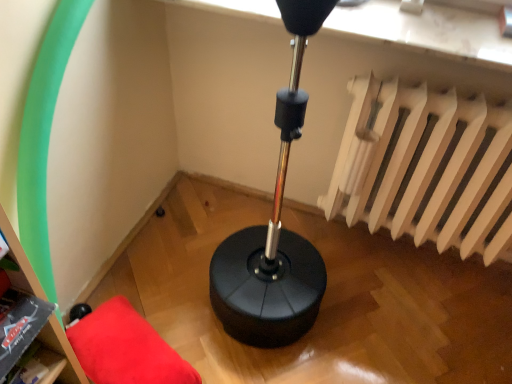
Question: From a real-world perspective, is matte black bookshelf at lower left over white matte radiator at upper right?

Choices:
 (A) yes
 (B) no

Answer: (A)

Question: Is the depth of matte black bookshelf at lower left less than that of white matte radiator at upper right?

Choices:
 (A) no
 (B) yes

Answer: (B)

Question: Is matte black bookshelf at lower left wider than white matte radiator at upper right?

Choices:
 (A) no
 (B) yes

Answer: (B)

Question: Can you confirm if matte black bookshelf at lower left is smaller than white matte radiator at upper right?

Choices:
 (A) no
 (B) yes

Answer: (B)

Question: Is matte black bookshelf at lower left not near white matte radiator at upper right?

Choices:
 (A) no
 (B) yes

Answer: (B)

Question: Looking at their shapes, would you say red fabric cushion at lower left is wider or thinner than white matte radiator at upper right?

Choices:
 (A) wide
 (B) thin

Answer: (A)

Question: In the image, is red fabric cushion at lower left positioned in front of or behind white matte radiator at upper right?

Choices:
 (A) front
 (B) behind

Answer: (B)

Question: Based on their positions, is red fabric cushion at lower left located to the left or right of white matte radiator at upper right?

Choices:
 (A) right
 (B) left

Answer: (B)

Question: From the image's perspective, is red fabric cushion at lower left above or below white matte radiator at upper right?

Choices:
 (A) above
 (B) below

Answer: (B)

Question: In the image, is white matte radiator at upper right positioned in front of or behind matte black bookshelf at lower left?

Choices:
 (A) behind
 (B) front

Answer: (A)

Question: Considering the positions of white matte radiator at upper right and matte black bookshelf at lower left in the image, is white matte radiator at upper right taller or shorter than matte black bookshelf at lower left?

Choices:
 (A) tall
 (B) short

Answer: (A)

Question: From a real-world perspective, is white matte radiator at upper right above or below matte black bookshelf at lower left?

Choices:
 (A) below
 (B) above

Answer: (A)

Question: Considering the positions of white matte radiator at upper right and matte black bookshelf at lower left in the image, is white matte radiator at upper right wider or thinner than matte black bookshelf at lower left?

Choices:
 (A) wide
 (B) thin

Answer: (B)

Question: Would you say white matte radiator at upper right is to the left or to the right of red fabric cushion at lower left in the picture?

Choices:
 (A) right
 (B) left

Answer: (A)

Question: In the image, is white matte radiator at upper right positioned in front of or behind red fabric cushion at lower left?

Choices:
 (A) behind
 (B) front

Answer: (B)